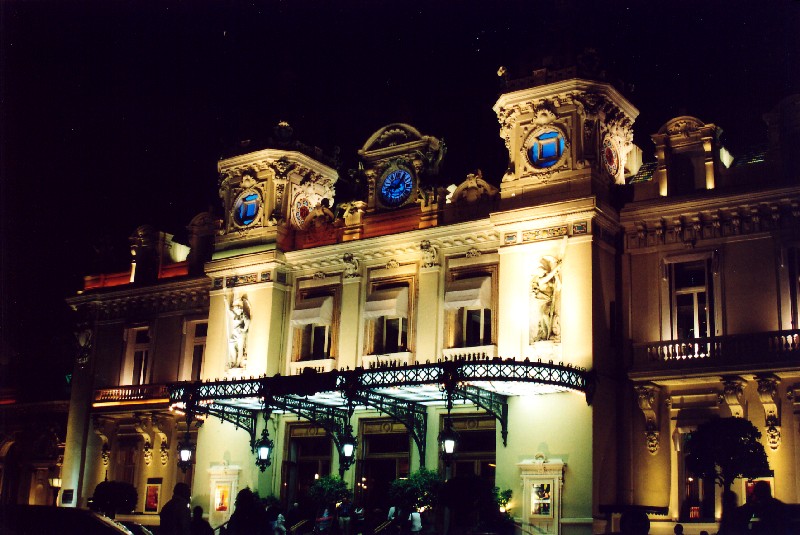
At what (x,y) coordinates should I click in order to perform the action: click on blue circle window. Please return your answer as a coordinate pair (x, y). The image size is (800, 535). Looking at the image, I should click on (250, 209), (546, 148).